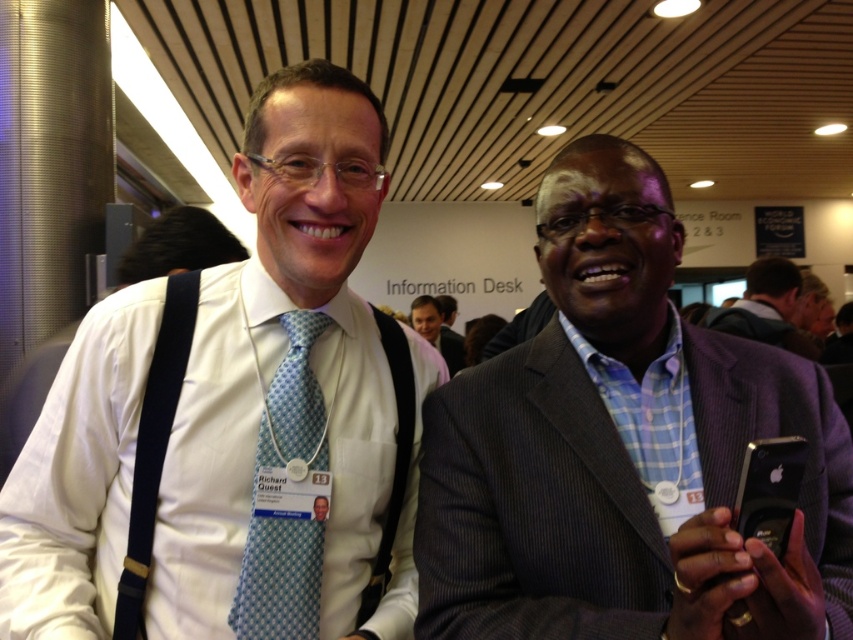
You are standing in the same room as the two people in the image. You need to locate the white shirt at left. Where exactly is it positioned in the room?

The white shirt at left is positioned at point 0.658 on the x axis and 0.275 on the y axis.

You are standing in a room and see a point marked at coordinates (42, 531). If you want to place a 30 inch wide painting on the wall so that it exactly covers this point, will the painting be large enough to cover the point?

The distance between the point and the viewer is 34.67 inches. Since the painting is only 30 inches wide, it will not be large enough to cover the point as it is shorter than the required distance.

You are standing in a room with two people. There is a point at coordinates (x=270, y=401). If you want to reach that point, which person should you approach first?

The point at coordinates (x=270, y=401) is 35.20 inches away from the viewer, so you should approach whichever person is closer to you. However, since the exact positions of the individuals relative to the point aren